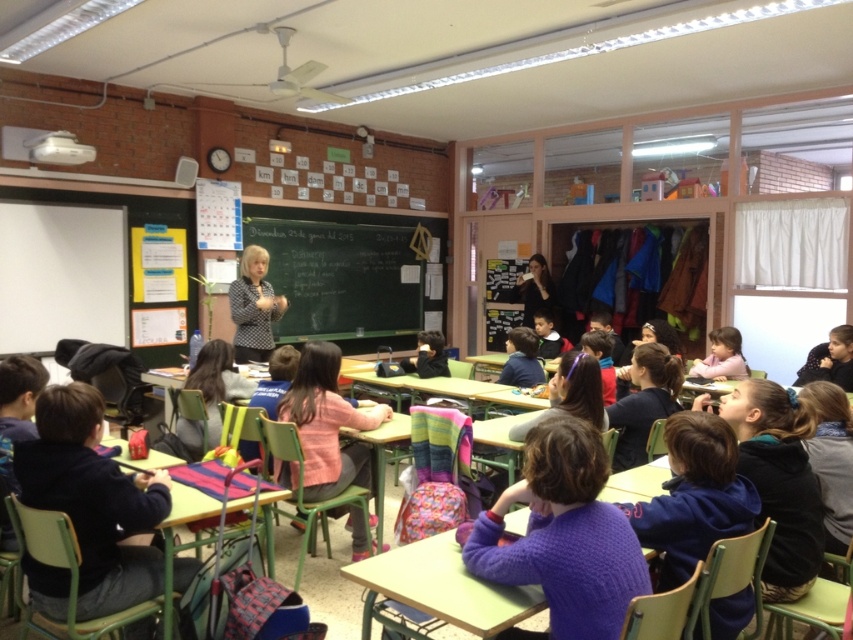
In the scene shown: You are standing in the classroom and want to reach both the point at coordinates (689, 428) and the point at coordinates (538, 381). Which point will you reach first if you move straight towards them?

You will reach the point at coordinates (689, 428) first because it is closer to you than the point at coordinates (538, 381).

You are standing at the entrance of the classroom and see the point at coordinates (328, 422). What object is located at that point?

The point at coordinates (328, 422) corresponds to the pink fabric backpack at center.

You are a student who wants to place both the purple fleece jacket at lower right and the blue sweater at center on your desk. The desk has a width of 40 cm. Can both items fit side by side?

The purple fleece jacket at lower right is wider than the blue sweater at center. Since the desk is only 40 cm wide, it depends on the combined width of both items. However, without knowing their exact dimensions, we cannot confirm if they will fit together.